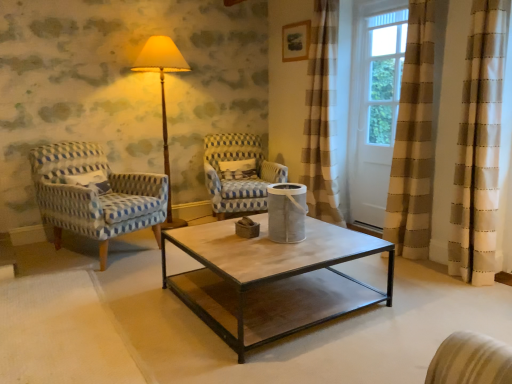
Question: Is blue and white woven fabric armchair at center, which appears as the 1th chair when viewed from the right, to the left or to the right of matte yellow fabric at center in the image?

Choices:
 (A) left
 (B) right

Answer: (B)

Question: From a real-world perspective, is blue and white woven fabric armchair at center, which is the second chair in left-to-right order, physically located above or below matte yellow fabric at center?

Choices:
 (A) below
 (B) above

Answer: (A)

Question: Considering the real-world distances, which object is farthest from the blue and white woven fabric armchair at center, which is the second chair in left-to-right order?

Choices:
 (A) matte yellow fabric at center
 (B) white textured pillow at center
 (C) white wood screen door at upper right
 (D) blue-patterned fabric armchair at left, which is the 1th chair from left to right

Answer: (C)

Question: Which object is positioned closest to the blue-patterned fabric armchair at left, which is the 1th chair from left to right?

Choices:
 (A) matte yellow fabric at center
 (B) white wood screen door at upper right
 (C) blue and white woven fabric armchair at center, which is the second chair in left-to-right order
 (D) white textured pillow at center

Answer: (C)